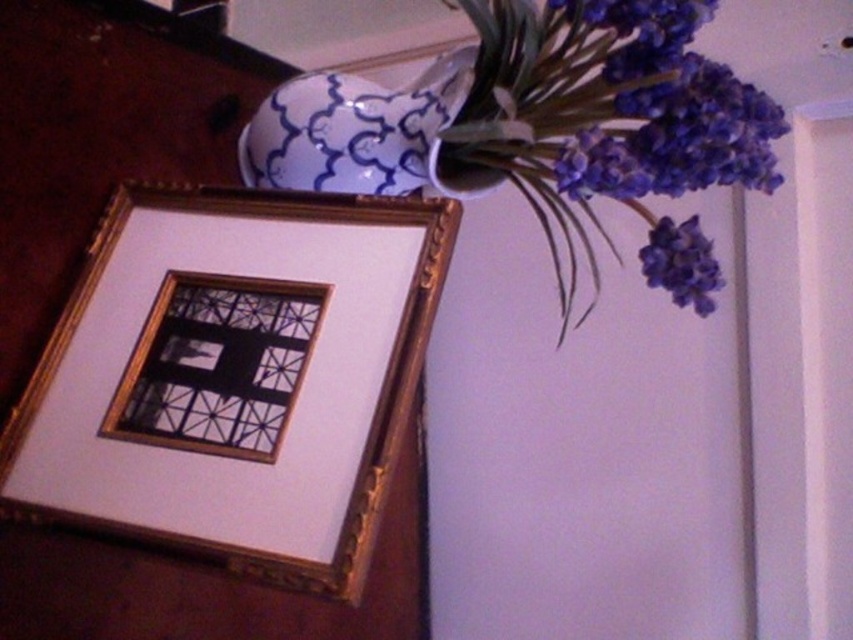
You are arranging flowers in a vase for a centerpiece. You have the blue glossy vase at upper right and the purple matte flowers at upper right. According to the image, which object is positioned to the left when placing them together?

The blue glossy vase at upper right is positioned to the left of the purple matte flowers at upper right.

From the picture: You are standing in front of the decorative arrangement on the wooden surface. There are two points marked on the surface, one at coordinates point (x=161, y=529) and the other at point (x=692, y=289). Which point is closer to you?

Point (x=161, y=529) is closer to the viewer than point (x=692, y=289).